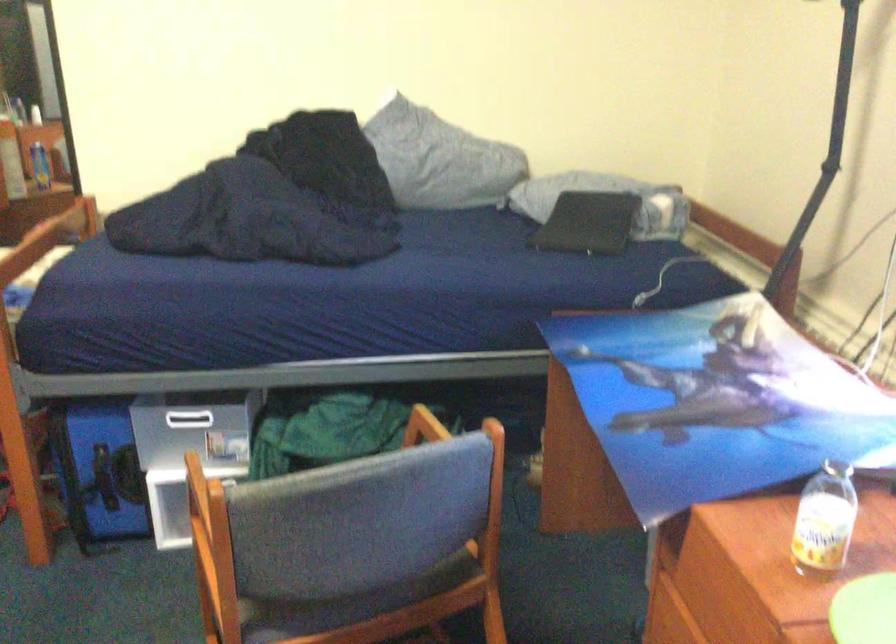
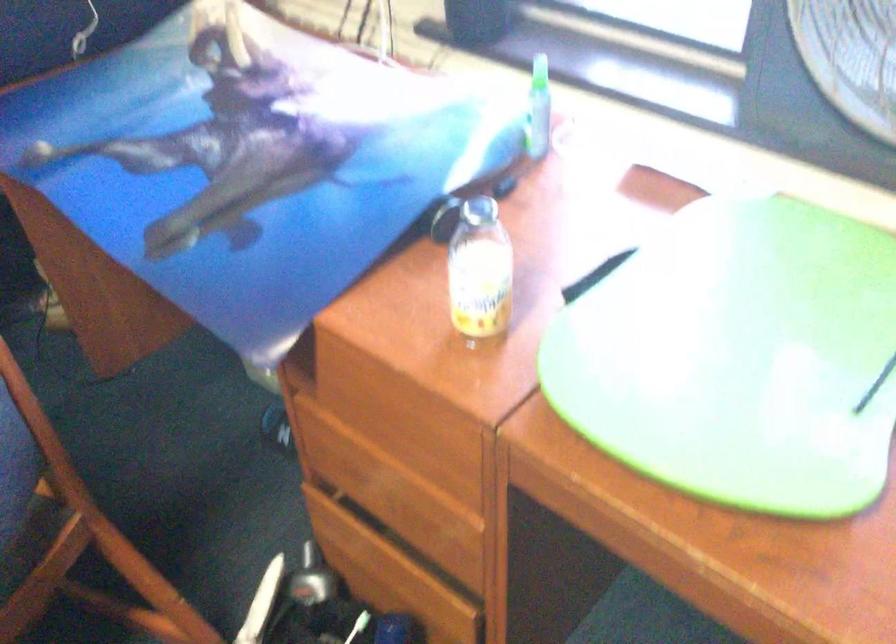
In the scene shown: Based on the continuous images, in which direction is the camera rotating?

The rotation direction of the camera is right-down.